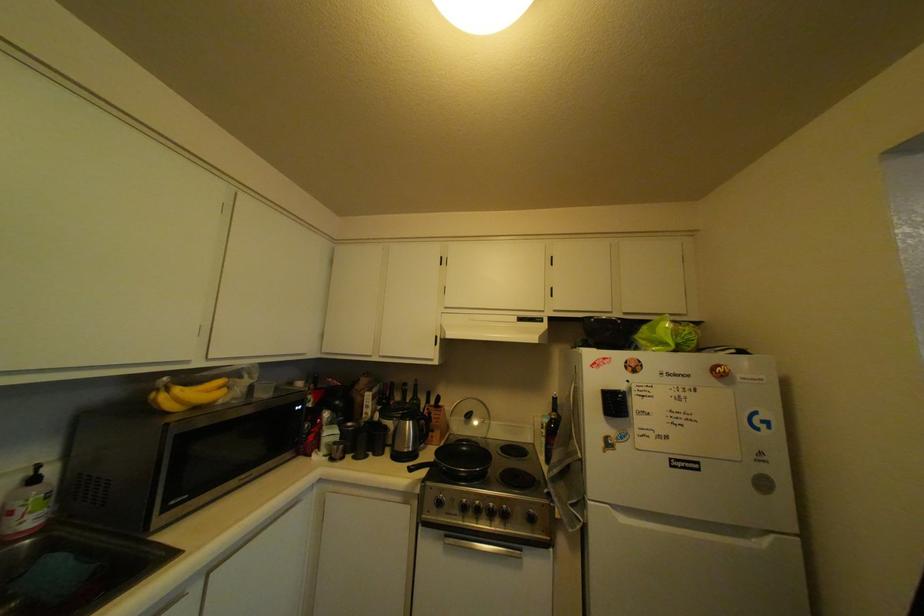
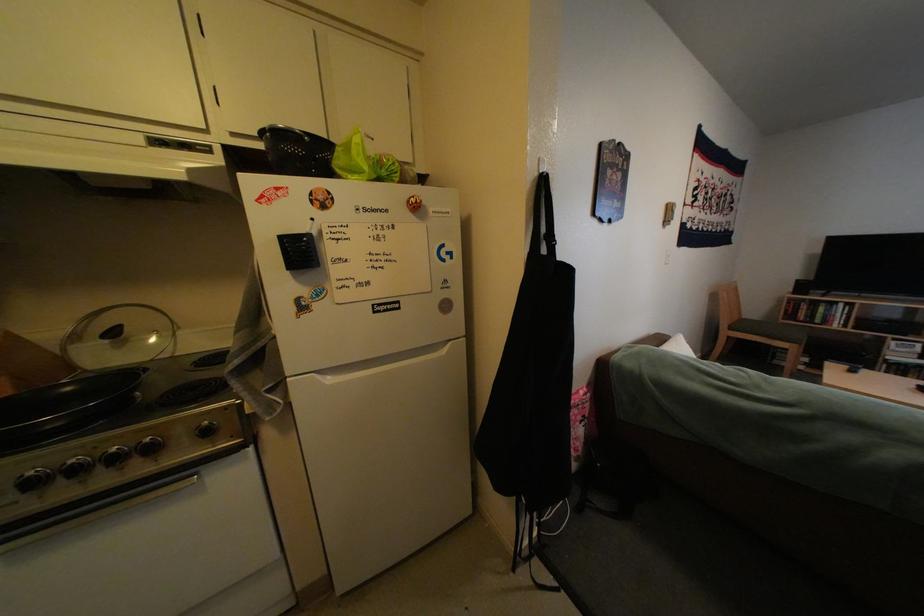
Find the pixel in the second image that matches the point at 499,500 in the first image.

(110, 448)